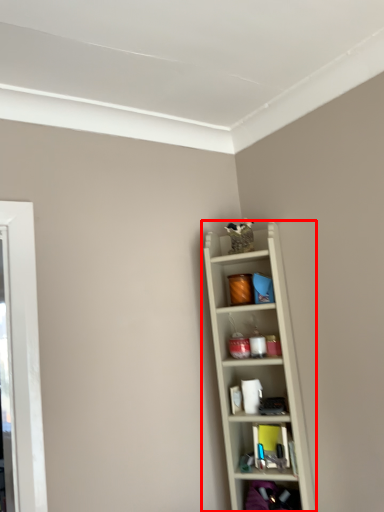
Question: From the image's perspective, where is shelf (annotated by the red box) located in relation to shelf in the image?

Choices:
 (A) below
 (B) above

Answer: (B)